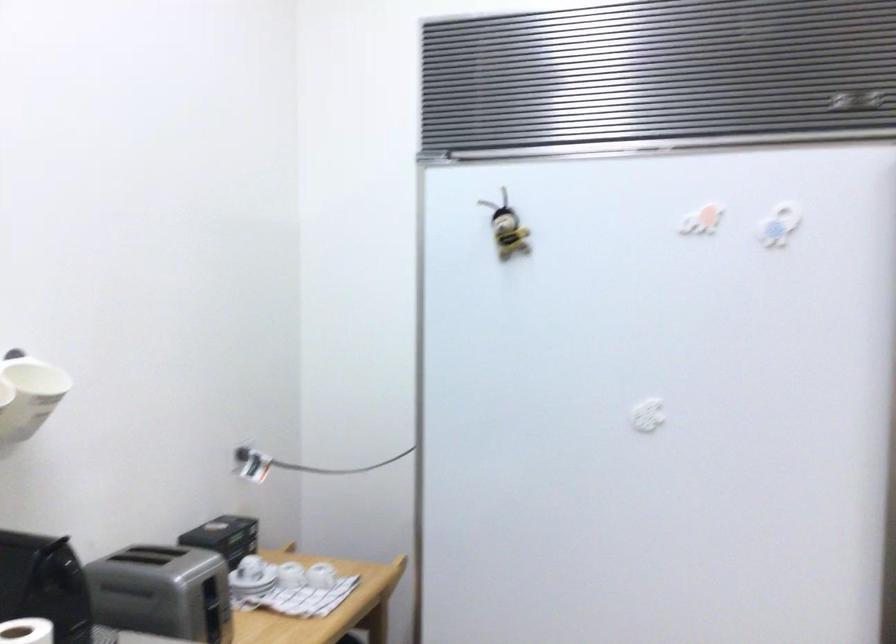
This screenshot has height=644, width=896. Describe the element at coordinates (670, 145) in the screenshot. I see `the freezer door handle` at that location.